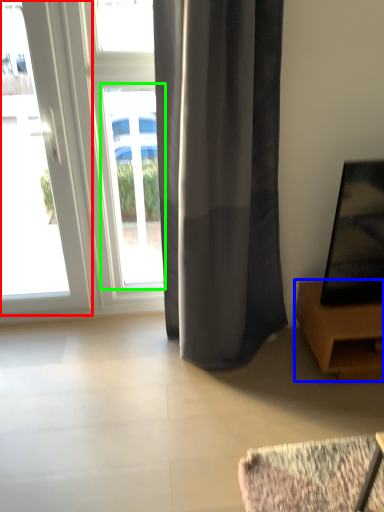
Question: Which object is the farthest from door (highlighted by a red box)? Choose among these: furniture (highlighted by a blue box) or window (highlighted by a green box).

Choices:
 (A) furniture
 (B) window

Answer: (A)